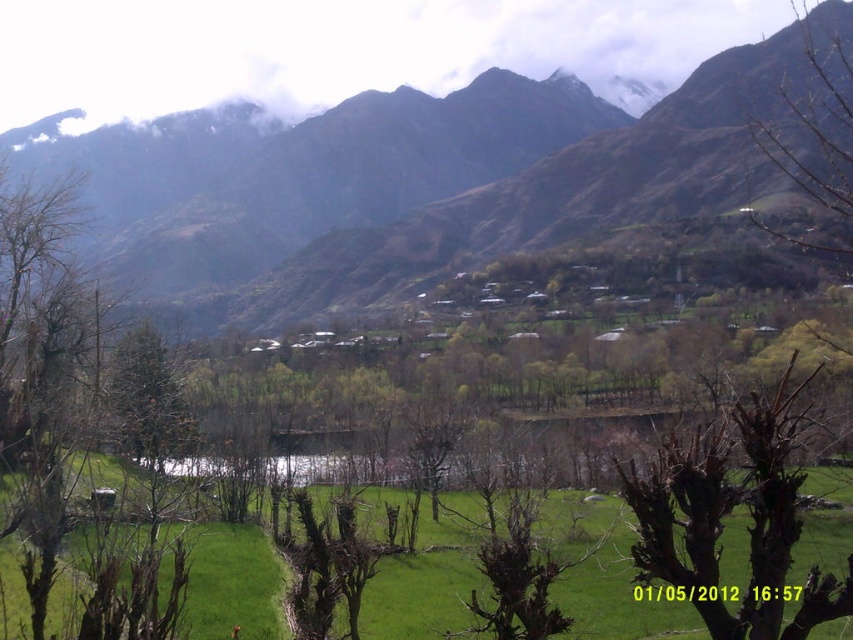
Question: Is brown rocky mountains at center below bare branches at upper right?

Choices:
 (A) yes
 (B) no

Answer: (B)

Question: Which object is closer to the camera taking this photo?

Choices:
 (A) brown rocky mountains at center
 (B) bare branches at upper right
 (C) brown dry branches at lower right
 (D) green leafy tree at left

Answer: (C)

Question: Which object is closer to the camera taking this photo?

Choices:
 (A) green leafy tree at left
 (B) bare branches at upper right
 (C) brown dry branches at lower right
 (D) brown rocky mountains at center

Answer: (C)

Question: Can you confirm if green leafy tree at left is wider than bare branches at upper right?

Choices:
 (A) no
 (B) yes

Answer: (A)

Question: Among these points, which one is nearest to the camera?

Choices:
 (A) (751, 572)
 (B) (785, 150)
 (C) (183, 572)
 (D) (540, 84)

Answer: (A)

Question: Can you confirm if brown rocky mountains at center is wider than green leafy tree at left?

Choices:
 (A) no
 (B) yes

Answer: (B)